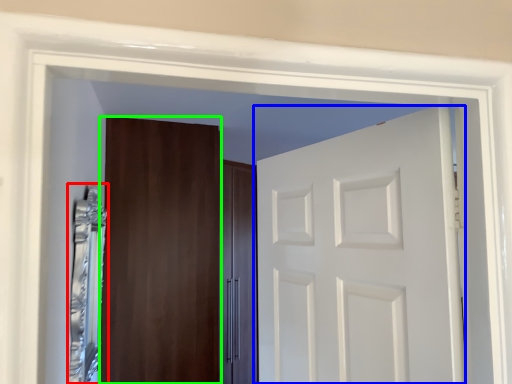
Question: Which is nearer to the mirror (highlighted by a red box)? door (highlighted by a blue box) or door (highlighted by a green box).

Choices:
 (A) door
 (B) door

Answer: (B)